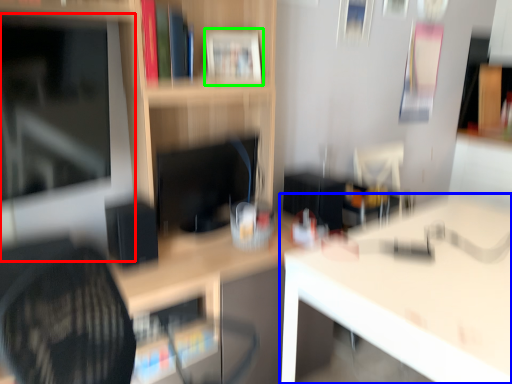
Question: Which is farther away from computer monitor (highlighted by a red box)? table (highlighted by a blue box) or book (highlighted by a green box)?

Choices:
 (A) table
 (B) book

Answer: (A)